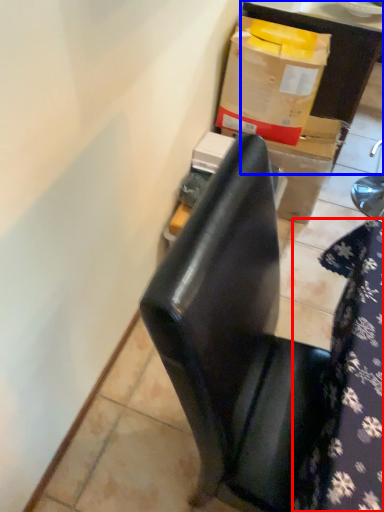
Question: Among these objects, which one is farthest to the camera, tablecloth (highlighted by a red box) or furniture (highlighted by a blue box)?

Choices:
 (A) tablecloth
 (B) furniture

Answer: (B)